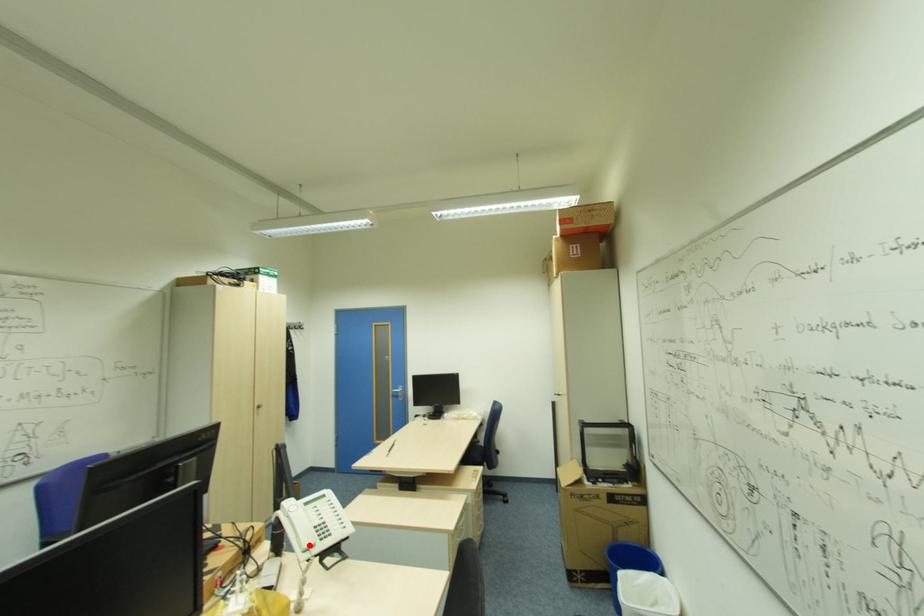
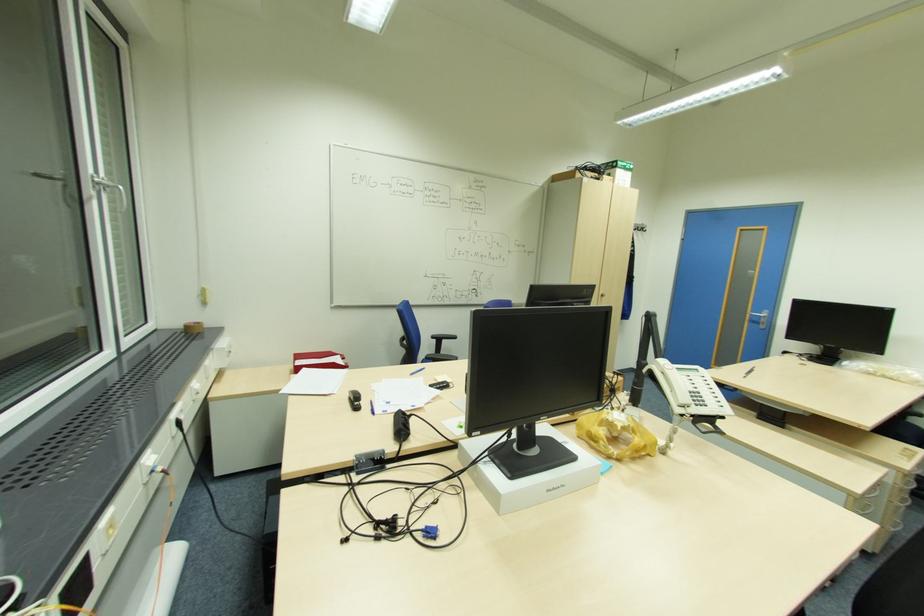
Find the pixel in the second image that matches the highlighted location in the first image.

(685, 400)